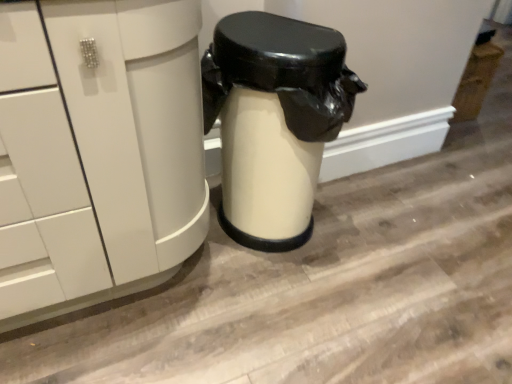
Question: From a real-world perspective, is white glossy trash can at center above or below white glossy cabinet at left?

Choices:
 (A) above
 (B) below

Answer: (B)

Question: Considering the positions of point (308, 203) and point (165, 195), is point (308, 203) closer or farther from the camera than point (165, 195)?

Choices:
 (A) farther
 (B) closer

Answer: (A)

Question: From the image's perspective, is white glossy trash can at center above or below white glossy cabinet at left?

Choices:
 (A) below
 (B) above

Answer: (B)

Question: Does point (33, 238) appear closer or farther from the camera than point (279, 79)?

Choices:
 (A) closer
 (B) farther

Answer: (A)

Question: In the image, is white glossy cabinet at left on the left side or the right side of white glossy trash can at center?

Choices:
 (A) right
 (B) left

Answer: (B)

Question: Is white glossy cabinet at left inside the boundaries of white glossy trash can at center, or outside?

Choices:
 (A) outside
 (B) inside

Answer: (A)

Question: From a real-world perspective, is white glossy cabinet at left positioned above or below white glossy trash can at center?

Choices:
 (A) below
 (B) above

Answer: (B)